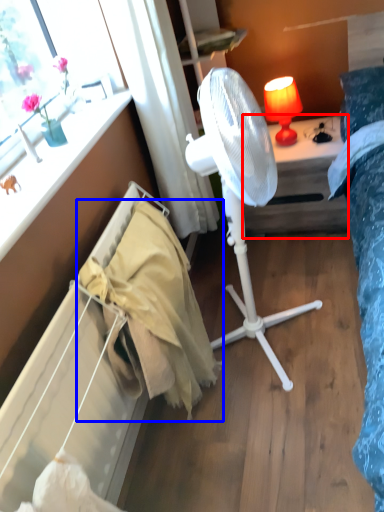
Question: Which point is further to the camera, desk (highlighted by a red box) or blanket (highlighted by a blue box)?

Choices:
 (A) desk
 (B) blanket

Answer: (A)